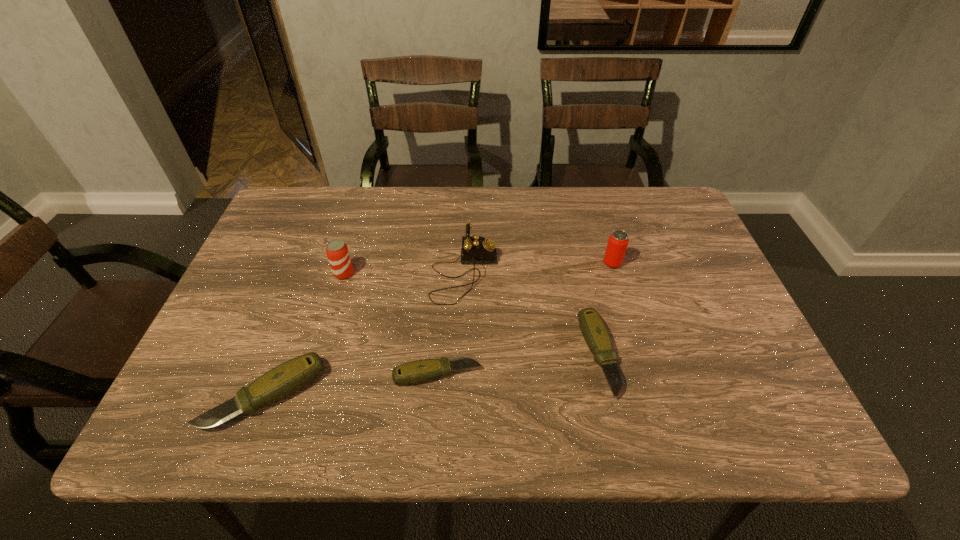
Identify the location of free area in between the telephone and the leftmost pocketknife. (365, 334).

Select which object is the third closest to the leftmost pocketknife. Please provide its 2D coordinates. Your answer should be formatted as a tuple, i.e. [(x, y)], where the tuple contains the x and y coordinates of a point satisfying the conditions above.

[(475, 249)]

Locate an element on the screen. This screenshot has height=540, width=960. object that can be found as the fifth closest to the shortest object is located at coordinates (618, 241).

You are a GUI agent. You are given a task and a screenshot of the screen. Output one action in this format:
    pyautogui.click(x=<x>, y=<y>)
    Task: Click on the pocketknife that stands as the second closest to the leftmost pocketknife
    Image resolution: width=960 pixels, height=540 pixels.
    Given the screenshot: What is the action you would take?
    pyautogui.click(x=596, y=335)

Choose which pocketknife is the nearest neighbor to the rightmost object. Please provide its 2D coordinates. Your answer should be formatted as a tuple, i.e. [(x, y)], where the tuple contains the x and y coordinates of a point satisfying the conditions above.

[(596, 335)]

Find the location of a particular element. The width and height of the screenshot is (960, 540). vacant area in the image that satisfies the following two spatial constraints: 1. on the front side of the left beer can; 2. on the right side of the shortest pocketknife is located at coordinates (314, 375).

Where is `vacant region that satisfies the following two spatial constraints: 1. on the dial of the second shortest object; 2. on the left side of the telephone`? This screenshot has height=540, width=960. vacant region that satisfies the following two spatial constraints: 1. on the dial of the second shortest object; 2. on the left side of the telephone is located at coordinates (461, 356).

Find the location of `free space that satisfies the following two spatial constraints: 1. on the front side of the right beer can; 2. on the dial of the telephone`. free space that satisfies the following two spatial constraints: 1. on the front side of the right beer can; 2. on the dial of the telephone is located at coordinates (615, 274).

At what (x,y) coordinates should I click in order to perform the action: click on vacant region that satisfies the following two spatial constraints: 1. on the front side of the right beer can; 2. on the dial of the telephone. Please return your answer as a coordinate pair (x, y). This screenshot has height=540, width=960. Looking at the image, I should click on [615, 274].

Find the location of `vacant area that satisfies the following two spatial constraints: 1. on the dial of the telephone; 2. on the right side of the second shortest pocketknife`. vacant area that satisfies the following two spatial constraints: 1. on the dial of the telephone; 2. on the right side of the second shortest pocketknife is located at coordinates (461, 356).